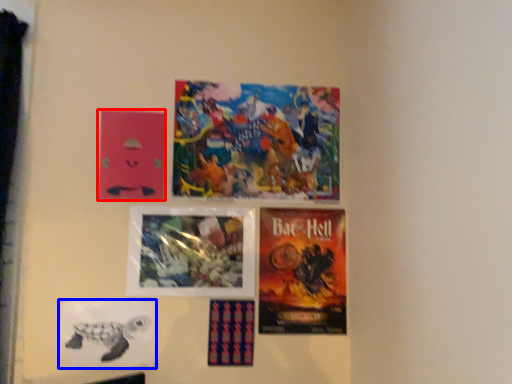
Question: Which object is closer to the camera taking this photo, poster (highlighted by a red box) or poster (highlighted by a blue box)?

Choices:
 (A) poster
 (B) poster

Answer: (B)